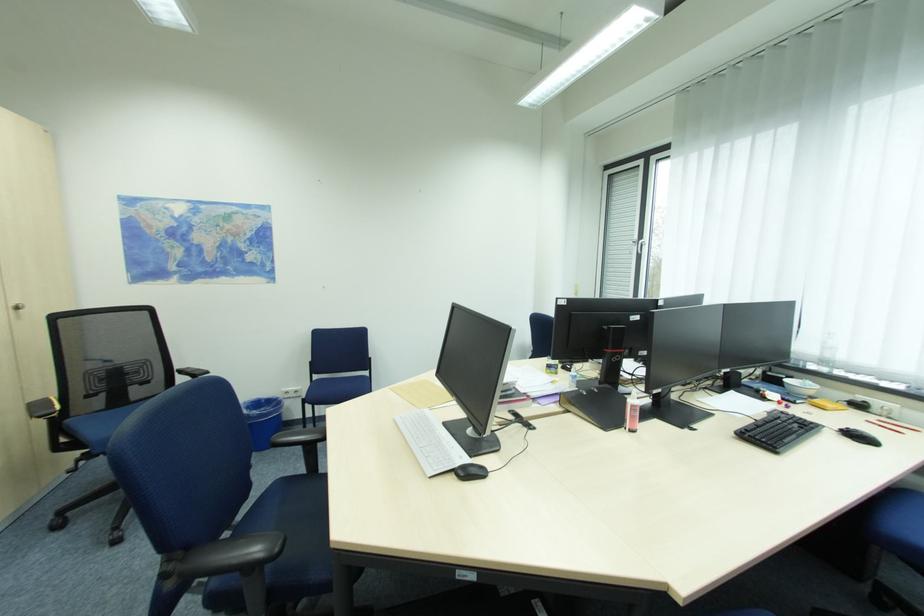
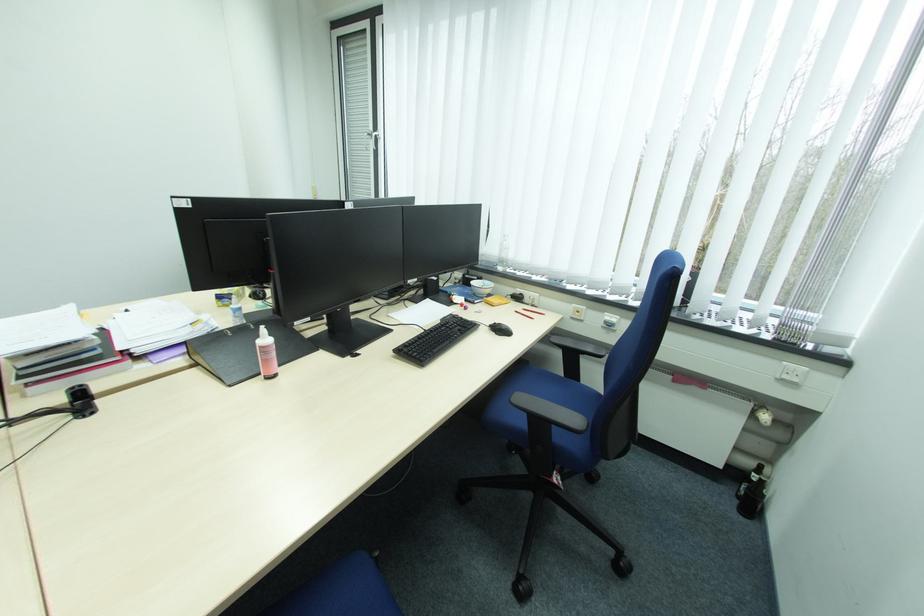
First-person continuous shooting, in which direction is the camera rotating?

The rotation direction of the camera is right-down.